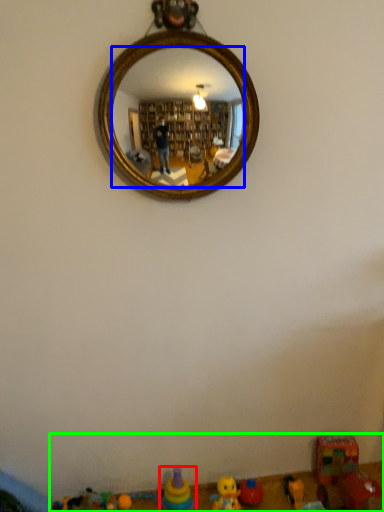
Question: Considering the real-world distances, which object is closest to toy (highlighted by a red box)? mirror (highlighted by a blue box) or toy (highlighted by a green box).

Choices:
 (A) mirror
 (B) toy

Answer: (B)